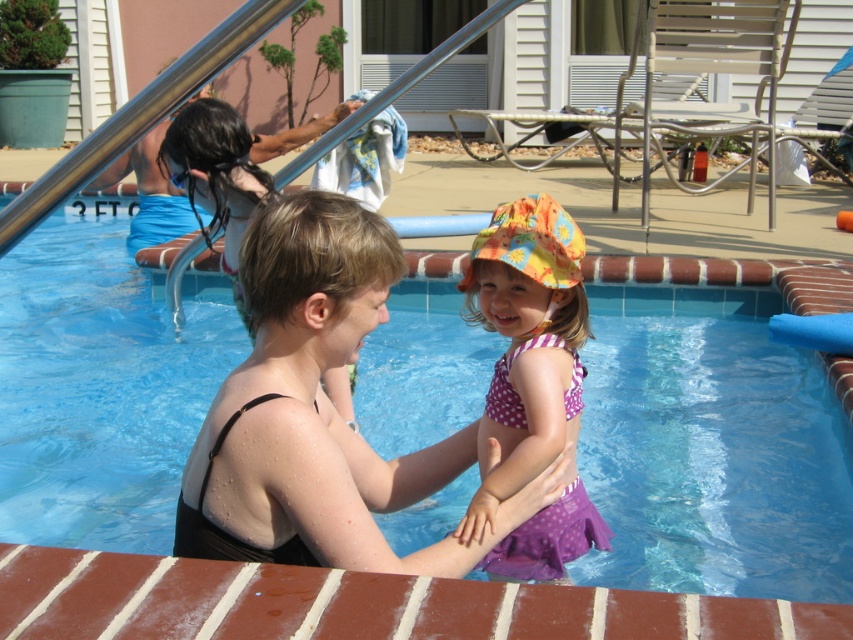
You are a photographer trying to capture a photo of the blue plastic goggles at upper left and the blue tile swimming pool at center. If you want to focus on the goggles first, which object should you adjust your camera to focus on first?

The blue plastic goggles at upper left should be focused on first because they are positioned above the blue tile swimming pool at center, making them closer to the camera.

You are a photographer standing at the edge of the pool. You want to capture a photo of the purple polka dot swimsuit at center. According to the coordinates given, where should you aim your camera to ensure the swimsuit is centered in the photo?

The purple polka dot swimsuit at center is located at coordinates point [526,342], so you should aim your camera at that point to center it in the photo.

You are a swimmer who wants to put on your blue plastic goggles at upper left before entering the blue tile swimming pool at center. Considering their sizes, will the goggles fit comfortably over your eyes without being too small?

The blue tile swimming pool at center is larger than the blue plastic goggles at upper left, so the goggles should fit comfortably over your eyes as they are not too small.